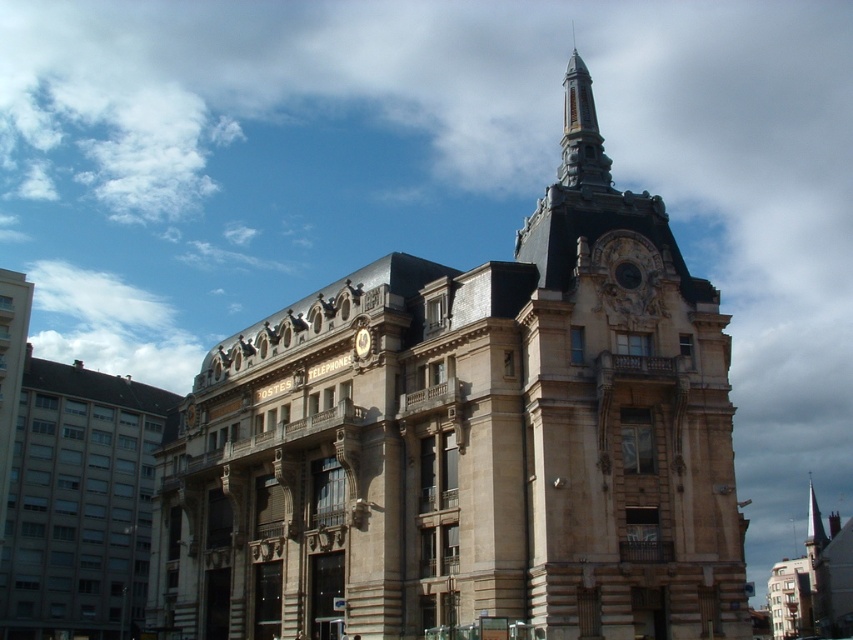
Measure the distance from stone steeple at center to polished stone spire at upper center.

A distance of 74.74 feet exists between stone steeple at center and polished stone spire at upper center.

Does stone steeple at center have a lesser width compared to polished stone spire at upper center?

No, stone steeple at center is not thinner than polished stone spire at upper center.

Which is behind, point (158, 554) or point (570, 129)?

Positioned behind is point (158, 554).

Find the location of a particular element. Image resolution: width=853 pixels, height=640 pixels. stone steeple at center is located at coordinates (465, 449).